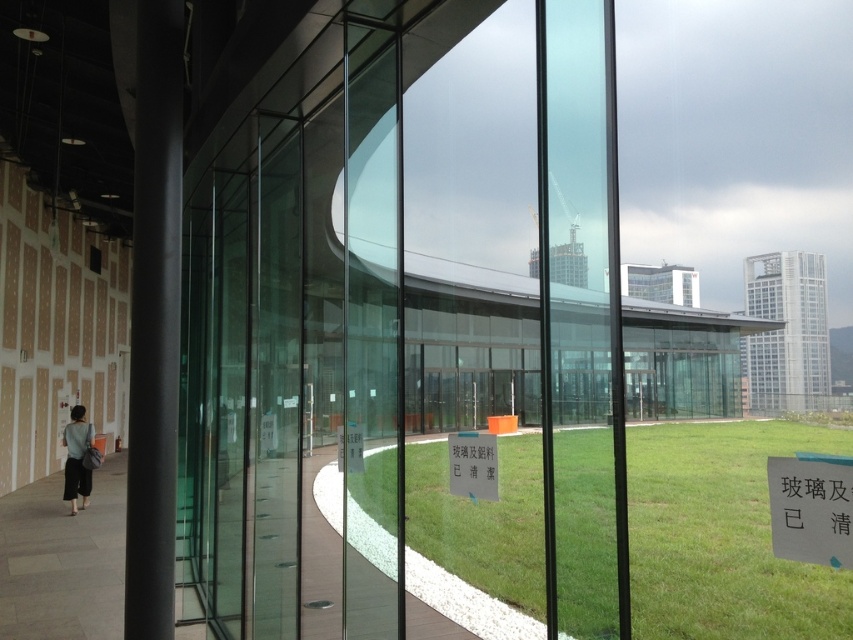
Does white paper sign at lower right have a greater height compared to green matte sign at center?

Yes, white paper sign at lower right is taller than green matte sign at center.

Based on the photo, which is more to the left, white paper sign at lower right or green matte sign at center?

green matte sign at center

Who is more forward, [815,460] or [451,481]?

Positioned in front is point [815,460].

Image resolution: width=853 pixels, height=640 pixels. What are the coordinates of `white paper sign at lower right` in the screenshot? It's located at (810, 509).

Does smooth concrete walkway at center appear on the right side of matte gray skirt at lower left?

Indeed, smooth concrete walkway at center is positioned on the right side of matte gray skirt at lower left.

The height and width of the screenshot is (640, 853). I want to click on smooth concrete walkway at center, so click(62, 561).

Is point (801, 529) positioned before point (338, 468)?

Yes, point (801, 529) is closer to viewer.

How distant is white paper sign at lower right from white paper sign at center?

2.62 meters

This screenshot has height=640, width=853. In order to click on white paper sign at lower right in this screenshot , I will do tap(810, 509).

Where is `white paper sign at lower right`? The image size is (853, 640). white paper sign at lower right is located at coordinates (810, 509).